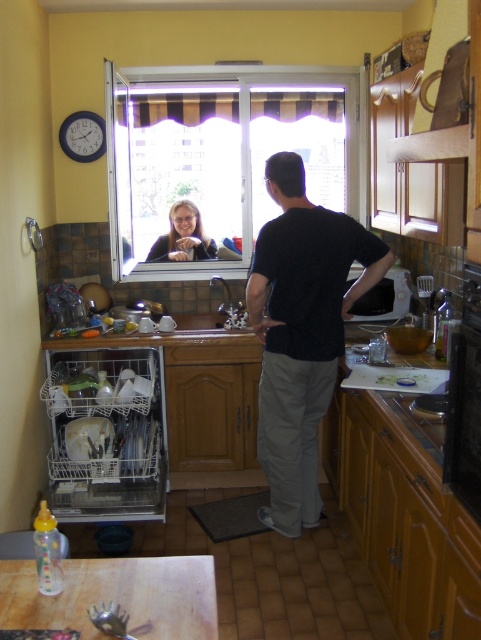
Question: Considering the relative positions of clear plastic dishwasher at lower left and white ceramic sink at center in the image provided, where is clear plastic dishwasher at lower left located with respect to white ceramic sink at center?

Choices:
 (A) right
 (B) left

Answer: (B)

Question: Is clear glass window at center smaller than black stainless steel oven at right?

Choices:
 (A) no
 (B) yes

Answer: (A)

Question: Which point is farther from the camera taking this photo?

Choices:
 (A) (285, 426)
 (B) (200, 141)
 (C) (227, 316)

Answer: (B)

Question: Based on their relative distances, which object is farther from the black cotton shirt at center?

Choices:
 (A) clear glass window at center
 (B) white ceramic sink at center

Answer: (A)

Question: Can you confirm if clear glass window at center is thinner than white ceramic sink at center?

Choices:
 (A) yes
 (B) no

Answer: (B)

Question: Which point is closer to the camera?

Choices:
 (A) black stainless steel oven at right
 (B) clear glass window at center
 (C) clear plastic dishwasher at lower left

Answer: (A)